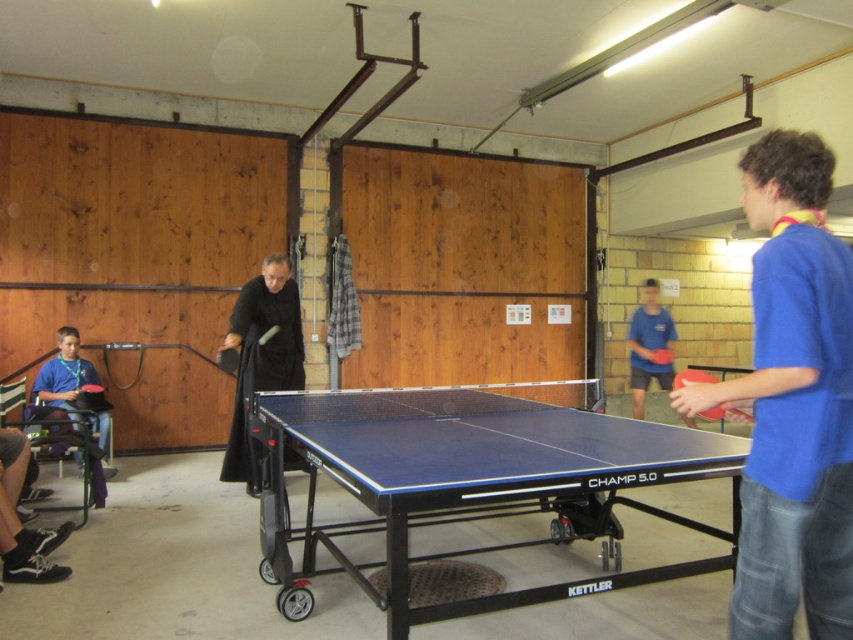
Question: Which point is closer to the camera?

Choices:
 (A) matte black shirt at left
 (B) blue matte table tennis table at center
 (C) rubber/soft table tennis at center

Answer: (B)

Question: Is blue rubber table at center positioned in front of blue fabric shirt at center?

Choices:
 (A) yes
 (B) no

Answer: (A)

Question: Is blue rubber table at center above blue cotton shirt at right?

Choices:
 (A) yes
 (B) no

Answer: (B)

Question: Estimate the real-world distances between objects in this image. Which object is farther from the blue rubber table at center?

Choices:
 (A) black matte/velvet robe at center
 (B) blue matte table tennis table at center
 (C) matte black shirt at left
 (D) rubber/soft table tennis at center

Answer: (D)

Question: Is blue cotton shirt at right positioned at the back of blue matte table tennis table at center?

Choices:
 (A) yes
 (B) no

Answer: (B)

Question: Among these objects, which one is nearest to the camera?

Choices:
 (A) blue cotton shirt at right
 (B) black matte/velvet robe at center
 (C) blue rubber table at center
 (D) blue matte table tennis table at center

Answer: (A)